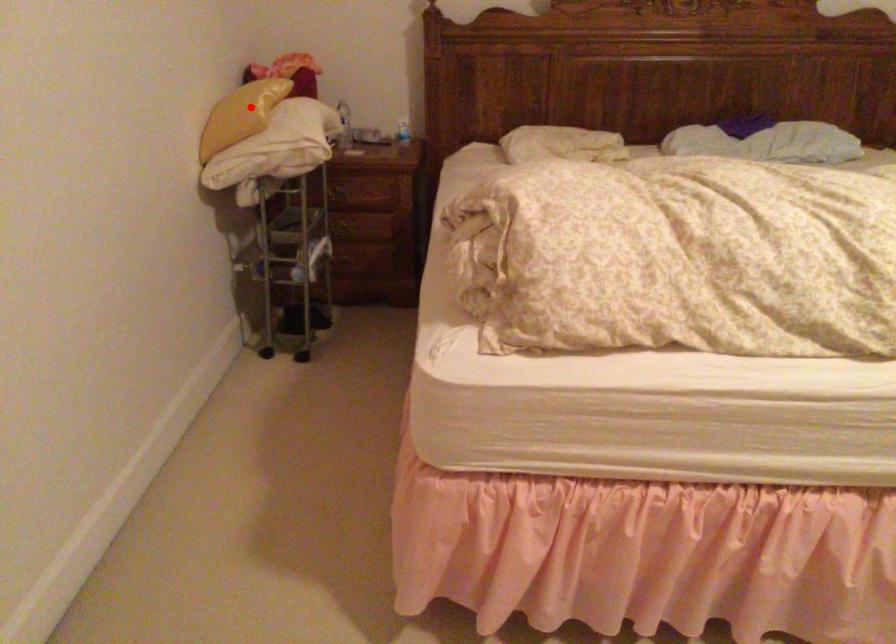
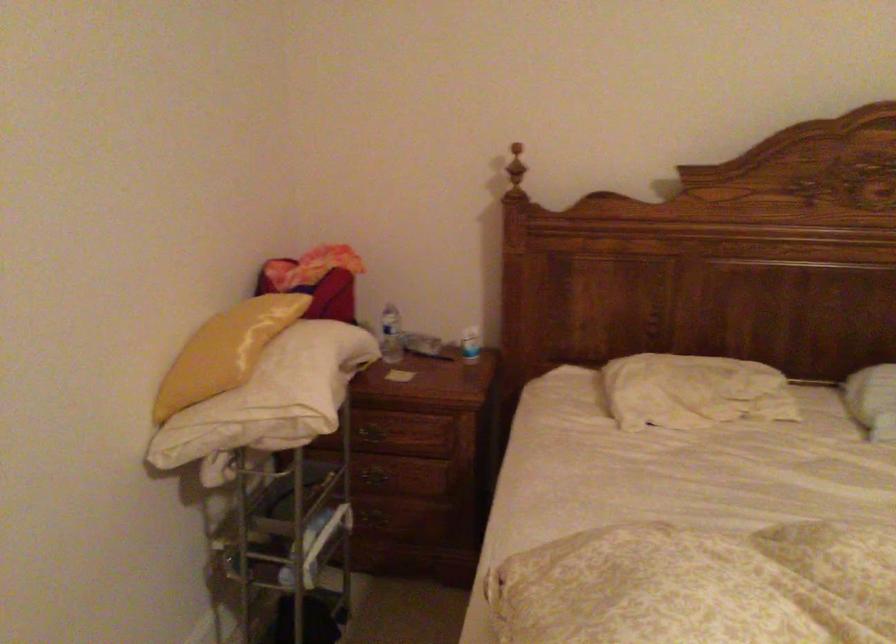
Question: A red point is marked in image1. In image2, is the corresponding 3D point closer to the camera or farther? Reply with the corresponding letter.

Choices:
 (A) The corresponding 3D point is closer.
 (B) The corresponding 3D point is farther.

Answer: (A)